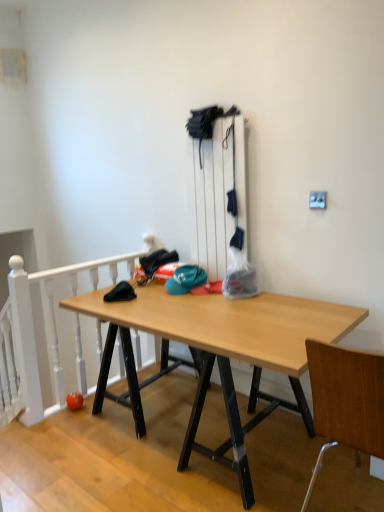
Question: Relative to white painted wood at left, is teal fabric cap at center in front or behind?

Choices:
 (A) behind
 (B) front

Answer: (A)

Question: Is point click(x=182, y=289) closer or farther from the camera than point click(x=54, y=344)?

Choices:
 (A) closer
 (B) farther

Answer: (A)

Question: Based on their relative distances, which object is farther from the white painted wood at left?

Choices:
 (A) wooden desk at center
 (B) teal fabric cap at center
 (C) wooden at right

Answer: (C)

Question: Which of these objects is positioned closest to the wooden desk at center?

Choices:
 (A) wooden at right
 (B) white painted wood at left
 (C) teal fabric cap at center

Answer: (C)